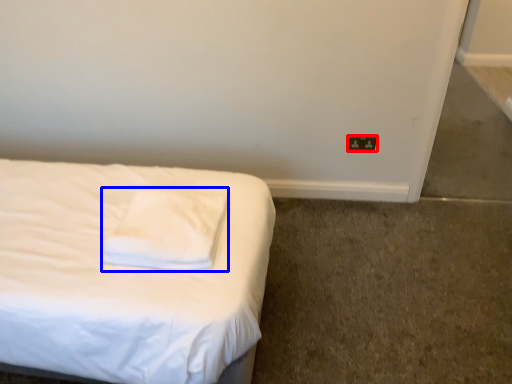
Question: Among these objects, which one is nearest to the camera, electric outlet (highlighted by a red box) or pillow (highlighted by a blue box)?

Choices:
 (A) electric outlet
 (B) pillow

Answer: (B)